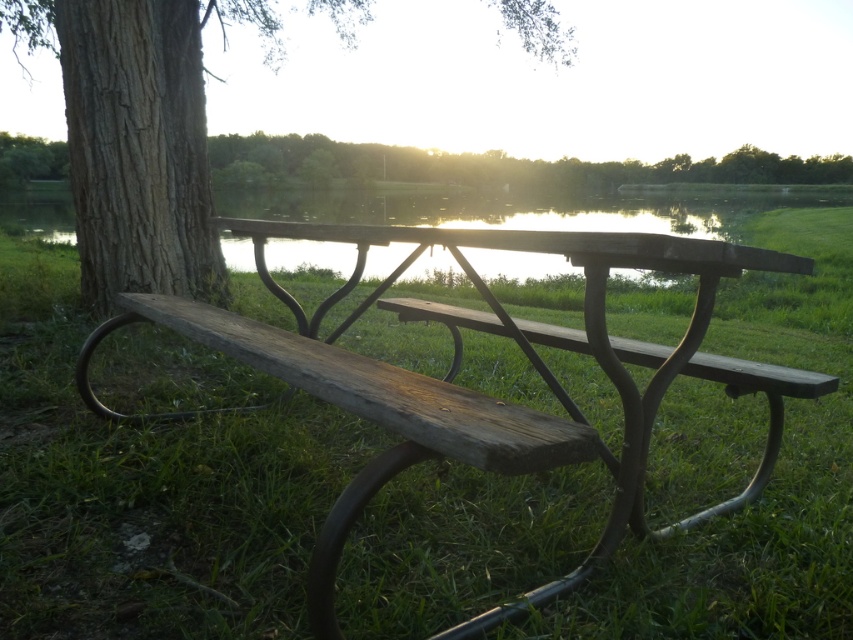
Is brown rough bark tree at left closer to the viewer compared to brown rough bark tree at upper left?

That is True.

Is brown rough bark tree at left positioned at the back of brown rough bark tree at upper left?

That is False.

Find the location of a particular element. brown rough bark tree at left is located at coordinates (138, 132).

Can you confirm if weathered wood bench at center is thinner than brown rough bark tree at upper left?

Yes.

Which is in front, point (524, 344) or point (45, 164)?

Point (524, 344) is more forward.

Between point (485, 420) and point (352, 161), which one is positioned behind?

The point (352, 161) is more distant.

What are the coordinates of `weathered wood bench at center` in the screenshot? It's located at (476, 392).

Between weathered wood bench at center and brown rough bark tree at left, which one appears on the left side from the viewer's perspective?

From the viewer's perspective, brown rough bark tree at left appears more on the left side.

Is point (592, 560) more distant than point (523, 45)?

No.

I want to click on weathered wood bench at center, so click(476, 392).